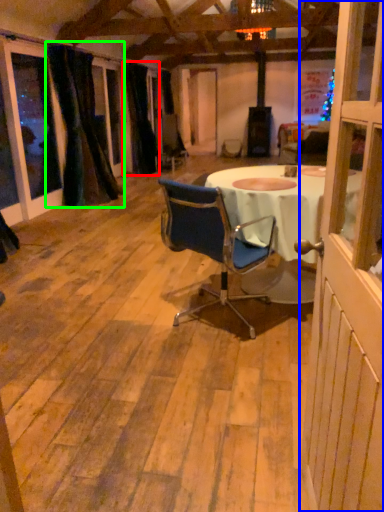
Question: Considering the real-world distances, which object is farthest from curtain (highlighted by a red box)? screen door (highlighted by a blue box) or curtain (highlighted by a green box)?

Choices:
 (A) screen door
 (B) curtain

Answer: (A)